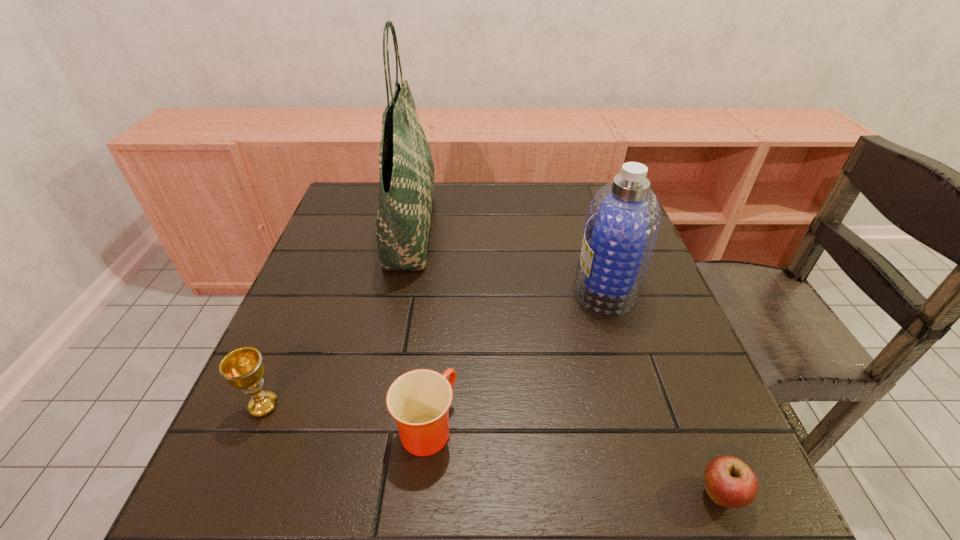
Where is `free spot at the near edge of the desktop`? The image size is (960, 540). free spot at the near edge of the desktop is located at coordinates (527, 519).

Identify the location of free spot at the left edge of the desktop. Image resolution: width=960 pixels, height=540 pixels. (290, 410).

The width and height of the screenshot is (960, 540). What are the coordinates of `free region at the far left corner of the desktop` in the screenshot? It's located at (377, 204).

Where is `free area in between the cup and the fourth shortest object`? This screenshot has width=960, height=540. free area in between the cup and the fourth shortest object is located at coordinates (516, 357).

Where is `empty space that is in between the nearest object and the chalice`? This screenshot has height=540, width=960. empty space that is in between the nearest object and the chalice is located at coordinates (492, 450).

Locate an element on the screen. vacant space that is in between the second tallest object and the chalice is located at coordinates (435, 347).

Locate an element on the screen. The width and height of the screenshot is (960, 540). vacant point located between the cup and the tote bag is located at coordinates (419, 327).

This screenshot has height=540, width=960. What are the coordinates of `vacant area that lies between the cleansing agent and the leftmost object` in the screenshot? It's located at (435, 347).

Locate an element on the screen. The width and height of the screenshot is (960, 540). vacant area that lies between the nearest object and the cup is located at coordinates (573, 461).

This screenshot has width=960, height=540. I want to click on free spot between the leftmost object and the cup, so click(345, 416).